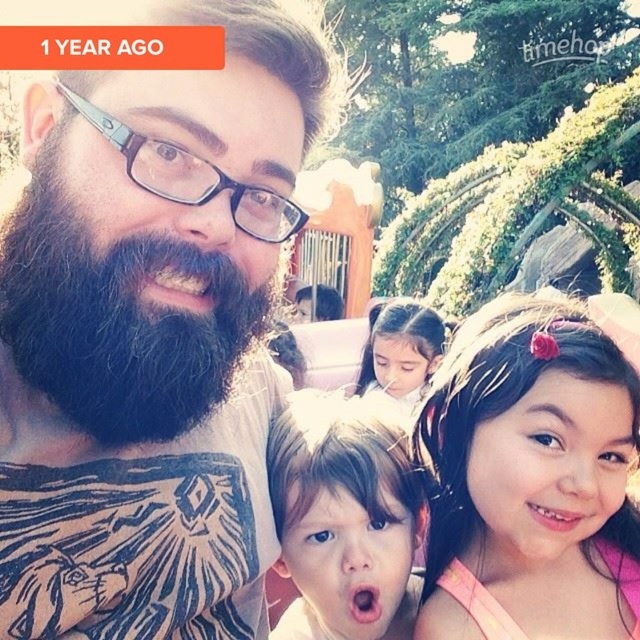
You are a photographer trying to frame a family portrait. You notice two subjects in the scene, the smooth skin face at center and the smooth skin girl at center. Which subject should you focus on if you want to capture someone who appears larger in the photo?

The smooth skin face at center is much taller than the smooth skin girl at center, so focusing on the smooth skin face at center will capture a larger subject in the photo.